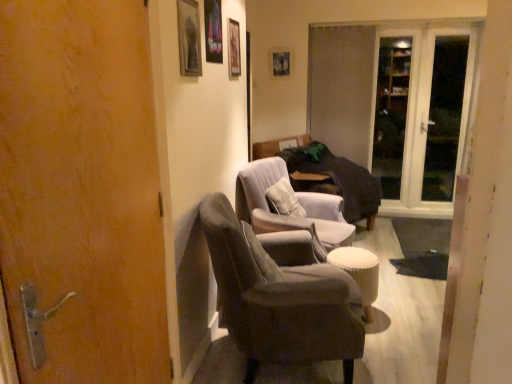
You are a GUI agent. You are given a task and a screenshot of the screen. Output one action in this format:
    pyautogui.click(x=<x>, y=<y>)
    Task: Click on the metallic glass picture frame at upper center, arranged as the second picture frame when viewed from the left
    
    Given the screenshot: What is the action you would take?
    pyautogui.click(x=213, y=31)

At what (x,y) coordinates should I click in order to perform the action: click on white glass door at upper right. Please return your answer as a coordinate pair (x, y). Looking at the image, I should click on point(444,117).

The width and height of the screenshot is (512, 384). What are the coordinates of `wooden picture frame at upper center, which appears as the fourth picture frame when viewed from the back` in the screenshot? It's located at (189, 38).

Describe the element at coordinates (279, 299) in the screenshot. Image resolution: width=512 pixels, height=384 pixels. I see `velvet grey armchair at center, which is the 1th chair in front-to-back order` at that location.

The height and width of the screenshot is (384, 512). What are the coordinates of `wooden picture frame at upper center, the 1th picture frame viewed from the back` in the screenshot? It's located at (280, 62).

From a real-world perspective, is wooden door at left physically located above or below suede-like gray armchair at center, the 1th chair in the back-to-front sequence?

wooden door at left is above suede-like gray armchair at center, the 1th chair in the back-to-front sequence.

Considering the points (129, 217) and (313, 214), which point is in front, point (129, 217) or point (313, 214)?

The point (129, 217) is in front.

Does wooden door at left have a greater height compared to suede-like gray armchair at center, the 1th chair in the back-to-front sequence?

Yes.

Is wooden picture frame at upper center, the fourth picture frame in the front-to-back sequence, located outside metallic glass picture frame at upper center, arranged as the second picture frame when viewed from the left?

That's correct, wooden picture frame at upper center, the fourth picture frame in the front-to-back sequence, is outside of metallic glass picture frame at upper center, arranged as the second picture frame when viewed from the left.

Locate an element on the screen. the 3rd picture frame positioned above the wooden picture frame at upper center, the 1th picture frame viewed from the back (from a real-world perspective) is located at coordinates (213, 31).

Is wooden picture frame at upper center, the 1th picture frame viewed from the back, facing away from metallic glass picture frame at upper center, positioned as the 3th picture frame in right-to-left order?

No, metallic glass picture frame at upper center, positioned as the 3th picture frame in right-to-left order, is not at the back of wooden picture frame at upper center, the 1th picture frame viewed from the back.

Is point (286, 58) positioned behind point (232, 62)?

Yes, point (286, 58) is farther from viewer.

Is the depth of wooden picture frame at upper center, the 1th picture frame viewed from the back, greater than that of wooden picture frame at upper center, marked as the second picture frame in a right-to-left arrangement?

Yes, the depth of wooden picture frame at upper center, the 1th picture frame viewed from the back, is greater than that of wooden picture frame at upper center, marked as the second picture frame in a right-to-left arrangement.

Does wooden picture frame at upper center, acting as the 4th picture frame starting from the left, have a larger size compared to wooden picture frame at upper center, acting as the 3th picture frame starting from the front?

Yes.

Can you confirm if wooden picture frame at upper center, the first picture frame positioned from the right, is positioned to the right of wooden picture frame at upper center, arranged as the second picture frame when viewed from the back?

Indeed, wooden picture frame at upper center, the first picture frame positioned from the right, is positioned on the right side of wooden picture frame at upper center, arranged as the second picture frame when viewed from the back.

Does wooden picture frame at upper center, the first picture frame from the front, have a larger size compared to velvet grey armchair at center, which is the 1th chair in front-to-back order?

Actually, wooden picture frame at upper center, the first picture frame from the front, might be smaller than velvet grey armchair at center, which is the 1th chair in front-to-back order.

There is a velvet grey armchair at center, which is the second chair from back to front. At what (x,y) coordinates should I click in order to perform the action: click on the 3rd picture frame above it (from a real-world perspective). Please return your answer as a coordinate pair (x, y). Looking at the image, I should click on (189, 38).

In the scene shown: What's the angular difference between wooden picture frame at upper center, the first picture frame from the front, and velvet grey armchair at center, which is the 1th chair in front-to-back order,'s facing directions?

20.8 degrees.

How much distance is there between wooden picture frame at upper center, the first picture frame from the front, and velvet grey armchair at center, which is the 1th chair in front-to-back order?

They are 1.08 meters apart.

Does metallic glass picture frame at upper center, acting as the second picture frame starting from the front, turn towards white glass door at upper right?

No, metallic glass picture frame at upper center, acting as the second picture frame starting from the front, is not aimed at white glass door at upper right.

From a real-world perspective, which is physically above, metallic glass picture frame at upper center, acting as the second picture frame starting from the front, or white glass door at upper right?

metallic glass picture frame at upper center, acting as the second picture frame starting from the front.

Does metallic glass picture frame at upper center, placed as the 3th picture frame when sorted from back to front, have a larger size compared to white glass door at upper right?

Incorrect, metallic glass picture frame at upper center, placed as the 3th picture frame when sorted from back to front, is not larger than white glass door at upper right.

Between point (208, 56) and point (441, 130), which one is positioned behind?

The point (441, 130) is more distant.

I want to click on chair in front of the suede-like gray armchair at center, the 1th chair in the back-to-front sequence, so click(x=279, y=299).

Which of these two, velvet grey armchair at center, which is the 1th chair in front-to-back order, or suede-like gray armchair at center, the 1th chair in the back-to-front sequence, is wider?

velvet grey armchair at center, which is the 1th chair in front-to-back order, is wider.

Considering the points (344, 332) and (241, 194), which point is in front, point (344, 332) or point (241, 194)?

The point (344, 332) is closer to the camera.

From the image's perspective, is velvet grey armchair at center, which is the 1th chair in front-to-back order, positioned above or below suede-like gray armchair at center, positioned as the 2th chair in front-to-back order?

velvet grey armchair at center, which is the 1th chair in front-to-back order, is situated lower than suede-like gray armchair at center, positioned as the 2th chair in front-to-back order, in the image.

Between velvet grey armchair at center, which is the 1th chair in front-to-back order, and transparent glass screen door at right, the third screen door when ordered from left to right, which one has smaller width?

With smaller width is transparent glass screen door at right, the third screen door when ordered from left to right.

Is transparent glass screen door at right, positioned as the first screen door in right-to-left order, completely or partially inside velvet grey armchair at center, which is the second chair from back to front?

No.

From the picture: From the image's perspective, is velvet grey armchair at center, which is the second chair from back to front, under transparent glass screen door at right, the third screen door when ordered from left to right?

Yes.

Looking at this image, can you tell me how much velvet grey armchair at center, which is the second chair from back to front, and transparent glass screen door at right, positioned as the first screen door in right-to-left order, differ in facing direction?

The facing directions of velvet grey armchair at center, which is the second chair from back to front, and transparent glass screen door at right, positioned as the first screen door in right-to-left order, are 111 degrees apart.

This screenshot has height=384, width=512. I want to click on the 2nd chair counting from the right of the wooden door at left, so click(288, 216).

Find the location of a particular element. the 2nd picture frame behind the metallic glass picture frame at upper center, placed as the 3th picture frame when sorted from back to front, starting your count from the anchor is located at coordinates pos(280,62).

Which object lies further to the anchor point transparent glass screen door at right, positioned as the first screen door in right-to-left order, transparent glass screen door at right, which appears as the 2th screen door when viewed from the right, or white glass door at upper right?

white glass door at upper right.

Looking at the image, which one is located closer to transparent glass screen door at right, placed as the 2th screen door when sorted from left to right, transparent glass screen door at right, positioned as the first screen door in right-to-left order, or white glass door at upper right?

Based on the image, white glass door at upper right appears to be nearer to transparent glass screen door at right, placed as the 2th screen door when sorted from left to right.

In the scene shown: From the image, which object appears to be farther from woven fabric stool at lower center, wooden picture frame at upper center, marked as the second picture frame in a right-to-left arrangement, or wooden door at left?

wooden door at left is further to woven fabric stool at lower center.

From the image, which object appears to be nearer to transparent glass screen door at right, placed as the 2th screen door when sorted from left to right, wooden door at left or woven fabric stool at lower center?

woven fabric stool at lower center is closer to transparent glass screen door at right, placed as the 2th screen door when sorted from left to right.

Consider the image. Considering their positions, is transparent glass screen door at right, which appears as the 2th screen door when viewed from the right, positioned further to wooden picture frame at upper center, the first picture frame from the front, than suede-like gray armchair at center, the 1th chair in the back-to-front sequence?

transparent glass screen door at right, which appears as the 2th screen door when viewed from the right.

Looking at the image, which one is located further to wooden door at left, velvet grey armchair at center, which is the second chair from back to front, or matte glass screen door at center, the 1th screen door viewed from the left?

Among the two, matte glass screen door at center, the 1th screen door viewed from the left, is located further to wooden door at left.

Which object lies nearer to the anchor point transparent glass screen door at right, positioned as the first screen door in right-to-left order, suede-like gray armchair at center, positioned as the 2th chair in front-to-back order, or wooden picture frame at upper center, acting as the 3th picture frame starting from the front?

The object closer to transparent glass screen door at right, positioned as the first screen door in right-to-left order, is suede-like gray armchair at center, positioned as the 2th chair in front-to-back order.

From the image, which object appears to be nearer to transparent glass screen door at right, the third screen door when ordered from left to right, metallic glass picture frame at upper center, positioned as the 3th picture frame in right-to-left order, or transparent glass screen door at right, placed as the 2th screen door when sorted from left to right?

transparent glass screen door at right, placed as the 2th screen door when sorted from left to right.

The image size is (512, 384). Find the location of `table between wooden picture frame at upper center, the fourth picture frame viewed from the right, and wooden picture frame at upper center, acting as the 4th picture frame starting from the left, from front to back`. table between wooden picture frame at upper center, the fourth picture frame viewed from the right, and wooden picture frame at upper center, acting as the 4th picture frame starting from the left, from front to back is located at coordinates (359, 273).

Where is `table located between wooden door at left and transparent glass screen door at right, which appears as the 2th screen door when viewed from the right, in the depth direction`? The width and height of the screenshot is (512, 384). table located between wooden door at left and transparent glass screen door at right, which appears as the 2th screen door when viewed from the right, in the depth direction is located at coordinates (359, 273).

The height and width of the screenshot is (384, 512). What are the coordinates of `table between velvet grey armchair at center, which is the second chair from back to front, and white glass door at upper right from front to back` in the screenshot? It's located at (359, 273).

Where is `window screen between woven fabric stool at lower center and transparent glass screen door at right, the third screen door when ordered from left to right, along the z-axis`? Image resolution: width=512 pixels, height=384 pixels. window screen between woven fabric stool at lower center and transparent glass screen door at right, the third screen door when ordered from left to right, along the z-axis is located at coordinates (444, 117).